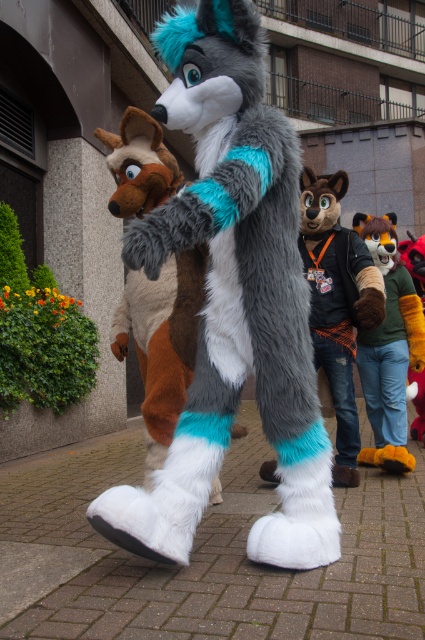
Does fluffy fur wolf at center have a greater height compared to fluffy fur suit at center?

Indeed, fluffy fur wolf at center has a greater height compared to fluffy fur suit at center.

Who is taller, fluffy fur wolf at center or fluffy fur suit at center?

fluffy fur wolf at center is taller.

What are the coordinates of `fluffy fur wolf at center` in the screenshot? It's located at (232, 300).

Does fluffy fur wolf at center appear on the left side of green fuzzy sweater at right?

Indeed, fluffy fur wolf at center is positioned on the left side of green fuzzy sweater at right.

Is fluffy fur wolf at center thinner than green fuzzy sweater at right?

No.

The image size is (425, 640). What do you see at coordinates (232, 300) in the screenshot?
I see `fluffy fur wolf at center` at bounding box center [232, 300].

The image size is (425, 640). Find the location of `fluffy fur wolf at center`. fluffy fur wolf at center is located at coordinates (232, 300).

How far apart are fluffy fur wolf at center and fluffy fur coat at center?

fluffy fur wolf at center and fluffy fur coat at center are 4.73 feet apart.

This screenshot has height=640, width=425. What do you see at coordinates (232, 300) in the screenshot? I see `fluffy fur wolf at center` at bounding box center [232, 300].

The width and height of the screenshot is (425, 640). What do you see at coordinates (232, 300) in the screenshot? I see `fluffy fur wolf at center` at bounding box center [232, 300].

The height and width of the screenshot is (640, 425). I want to click on fluffy fur wolf at center, so pyautogui.click(x=232, y=300).